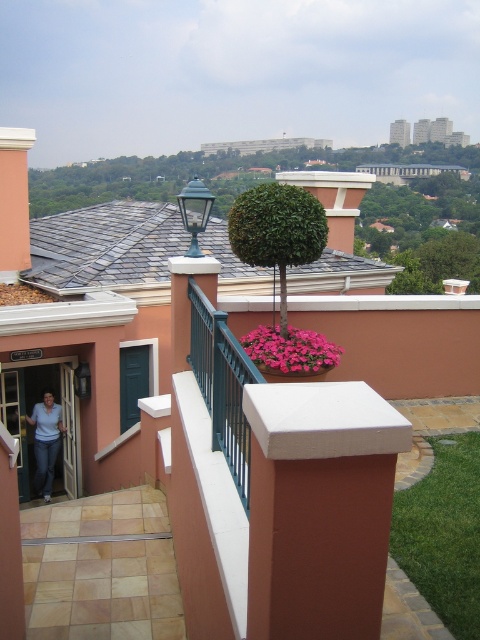
Question: Does teal metal/rail at center appear under denim jeans at left?

Choices:
 (A) no
 (B) yes

Answer: (A)

Question: Is green leafy tree at center further to camera compared to pink matte flower pot at center?

Choices:
 (A) no
 (B) yes

Answer: (A)

Question: Can you confirm if green leafy tree at center is positioned above denim jeans at left?

Choices:
 (A) no
 (B) yes

Answer: (B)

Question: Which point appears closest to the camera in this image?

Choices:
 (A) (385, 195)
 (B) (45, 468)
 (C) (273, 346)
 (D) (240, 250)

Answer: (D)

Question: Which point appears farthest from the camera in this image?

Choices:
 (A) (272, 362)
 (B) (36, 436)
 (C) (235, 156)

Answer: (C)

Question: Which point is closer to the camera taking this photo?

Choices:
 (A) (218, 422)
 (B) (48, 449)

Answer: (A)